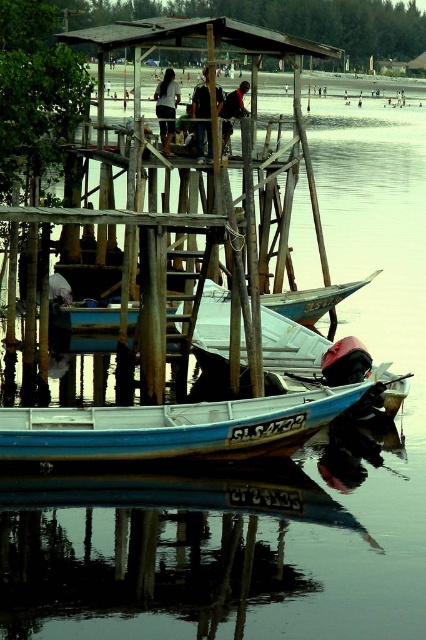
Question: Can you confirm if wooden canoe at center is positioned to the left of dark blue shirt at center?

Choices:
 (A) yes
 (B) no

Answer: (A)

Question: Observing the image, what is the correct spatial positioning of wooden canoe at center in reference to dark blue shirt at center?

Choices:
 (A) below
 (B) above

Answer: (A)

Question: Which point is farther from the camera taking this photo?

Choices:
 (A) (203, 109)
 (B) (97, 413)

Answer: (A)

Question: Based on their relative distances, which object is farther from the dark blue jeans at center?

Choices:
 (A) dark brown leather jacket at upper center
 (B) wooden canoe at center
 (C) dark blue shirt at center

Answer: (B)

Question: Which of the following is the closest to the observer?

Choices:
 (A) (229, 420)
 (B) (198, 90)
 (C) (238, 109)
 (D) (169, 132)

Answer: (A)

Question: Can you confirm if wooden canoe at center is bigger than dark brown leather jacket at upper center?

Choices:
 (A) yes
 (B) no

Answer: (A)